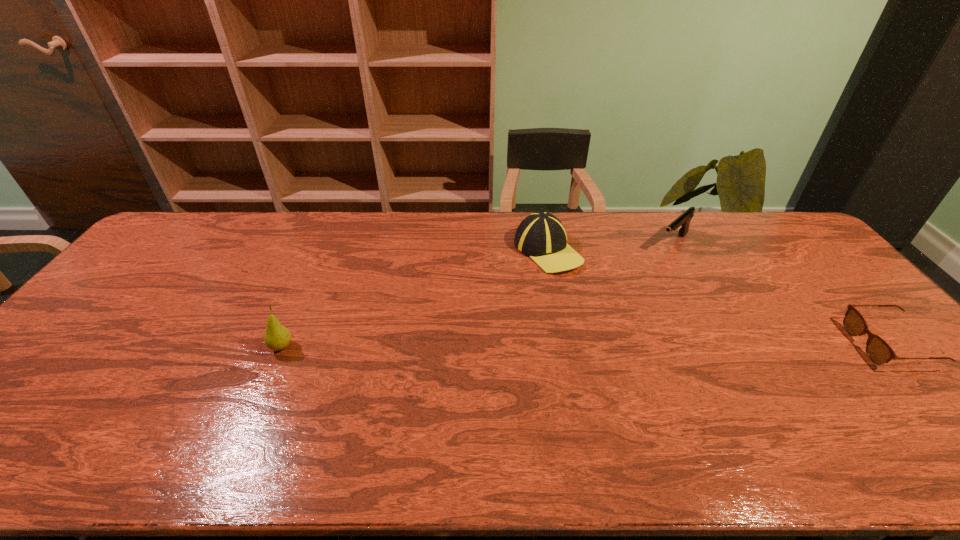
The image size is (960, 540). What are the coordinates of `free region at the near edge of the desktop` in the screenshot? It's located at (372, 422).

The width and height of the screenshot is (960, 540). I want to click on vacant space at the right edge of the desktop, so click(779, 257).

Where is `vacant space at the far left corner of the desktop`? This screenshot has height=540, width=960. vacant space at the far left corner of the desktop is located at coordinates point(179,217).

Where is `free region at the far right corner`? Image resolution: width=960 pixels, height=540 pixels. free region at the far right corner is located at coordinates (760, 238).

At what (x,y) coordinates should I click in order to perform the action: click on vacant space at the near right corner of the desktop. Please return your answer as a coordinate pair (x, y). Looking at the image, I should click on (909, 407).

Find the location of a particular element. The width and height of the screenshot is (960, 540). free spot between the second object from left to right and the tallest object is located at coordinates (415, 299).

This screenshot has height=540, width=960. Identify the location of free space between the tallest object and the spectacles. (585, 346).

Find the location of a particular element. Image resolution: width=960 pixels, height=540 pixels. vacant space that's between the third object from right to left and the pistol is located at coordinates (611, 247).

Locate an element on the screen. This screenshot has width=960, height=540. free spot between the second object from left to right and the spectacles is located at coordinates (718, 298).

At what (x,y) coordinates should I click in order to perform the action: click on vacant point located between the leftmost object and the baseball cap. Please return your answer as a coordinate pair (x, y). This screenshot has width=960, height=540. Looking at the image, I should click on (415, 299).